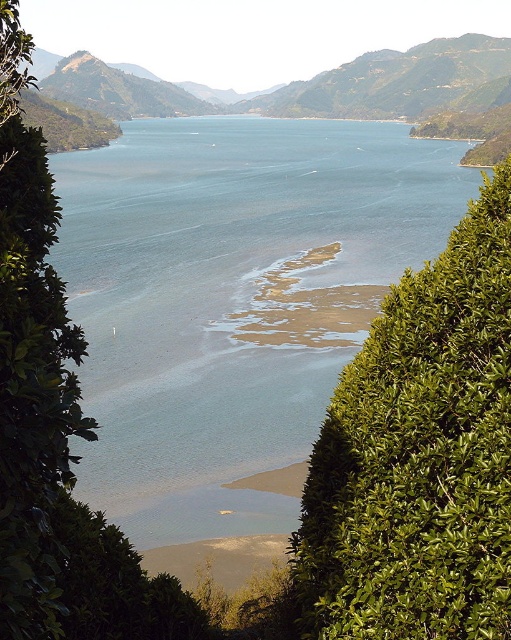
Question: Is clear blue water at center to the right of green leafy bush at center from the viewer's perspective?

Choices:
 (A) yes
 (B) no

Answer: (B)

Question: Which point is farther to the camera?

Choices:
 (A) green leafy bush at center
 (B) clear blue water at center

Answer: (B)

Question: Can you confirm if clear blue water at center is positioned to the right of green leafy bush at center?

Choices:
 (A) no
 (B) yes

Answer: (A)

Question: Among these objects, which one is nearest to the camera?

Choices:
 (A) clear blue water at center
 (B) green leafy bush at center

Answer: (B)

Question: Can you confirm if clear blue water at center is bigger than green leafy bush at center?

Choices:
 (A) no
 (B) yes

Answer: (B)